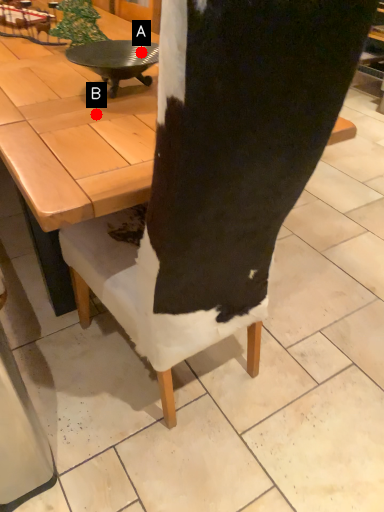
Question: Two points are circled on the image, labeled by A and B beside each circle. Which of the following is the closest to the observer?

Choices:
 (A) A is closer
 (B) B is closer

Answer: (B)